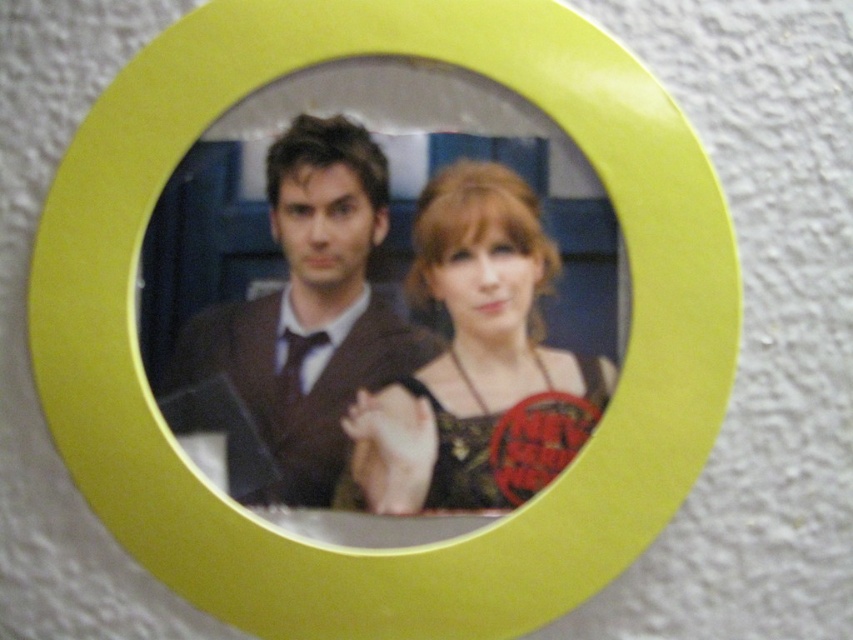
Consider the image. Is matte black dress at center positioned behind matte brown suit at center?

No, matte black dress at center is closer to the viewer.

Which is above, matte black dress at center or matte brown suit at center?

matte brown suit at center is above.

Measure the distance between matte black dress at center and camera.

They are 21.12 inches apart.

Image resolution: width=853 pixels, height=640 pixels. Find the location of `matte black dress at center`. matte black dress at center is located at coordinates (476, 362).